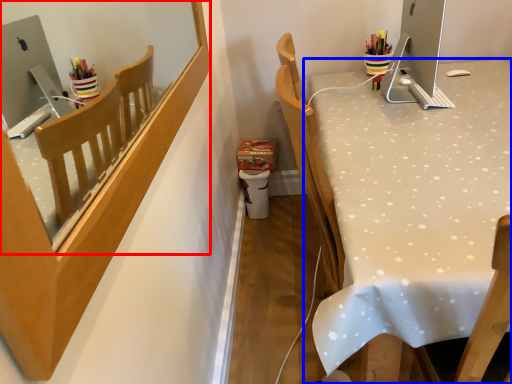
Question: Which object appears farthest to the camera in this image, mirror (highlighted by a red box) or desk (highlighted by a blue box)?

Choices:
 (A) mirror
 (B) desk

Answer: (B)